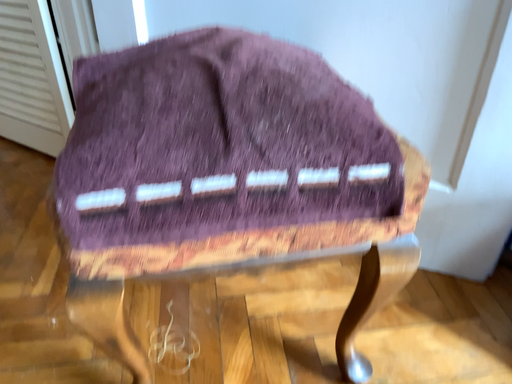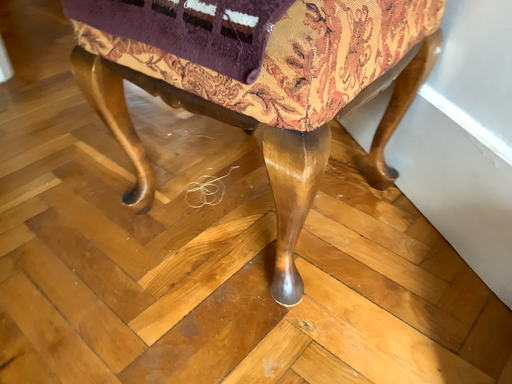
Question: Which way did the camera rotate in the video?

Choices:
 (A) rotated left
 (B) rotated right

Answer: (A)